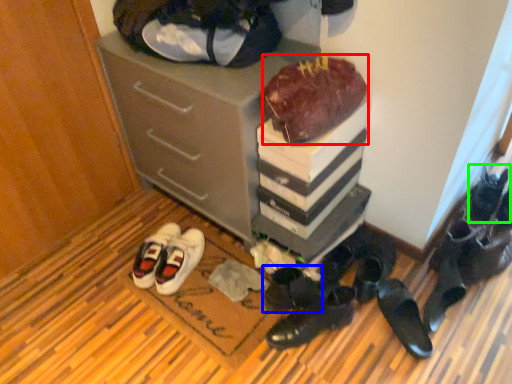
Question: Which is farther away from chocolate cake (highlighted by a red box)? footwear (highlighted by a blue box) or footwear (highlighted by a green box)?

Choices:
 (A) footwear
 (B) footwear

Answer: (B)